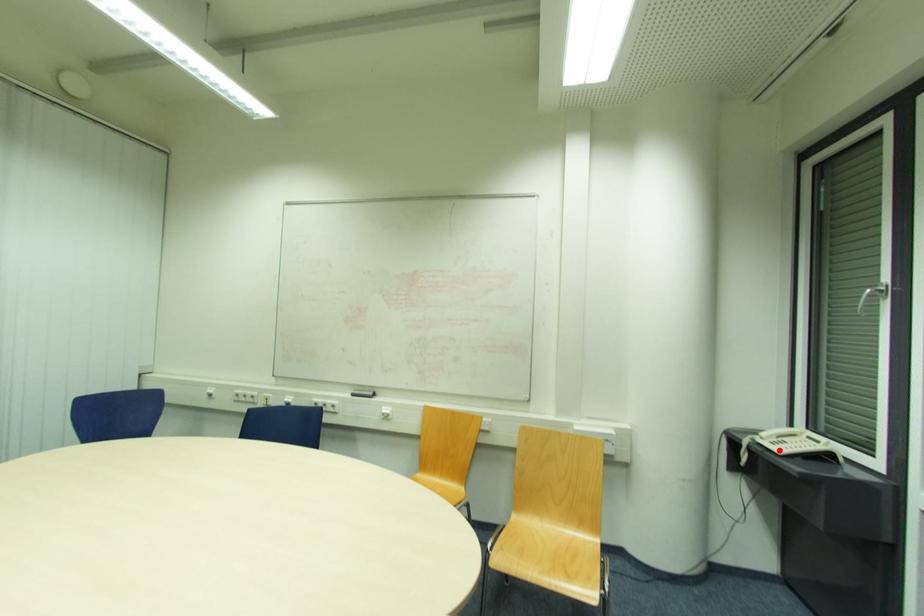
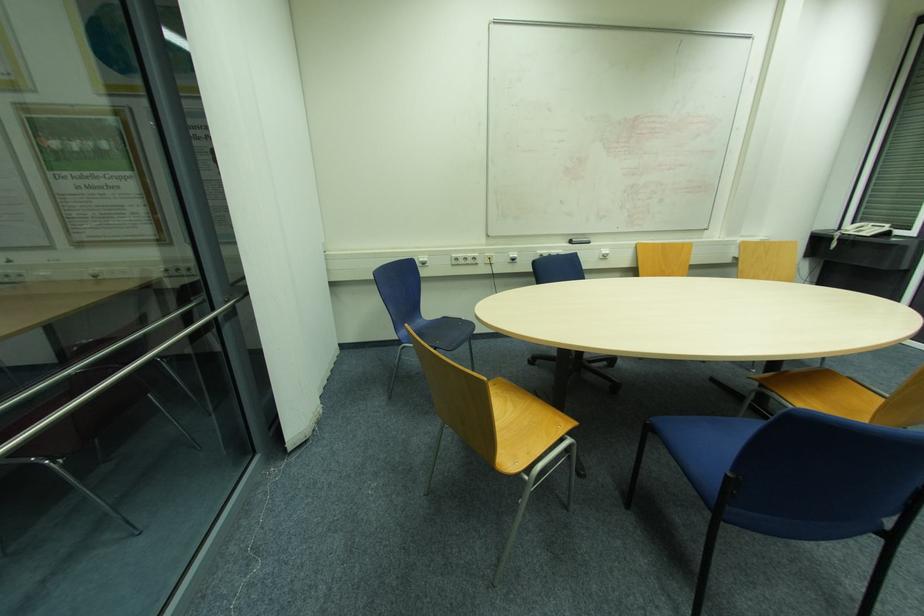
Question: I am providing you with two images of the same scene from different viewpoints. Image1 has a red point marked. In image2, the corresponding 3D location appears at what relative position? Reply with the corresponding letter.

Choices:
 (A) Closer
 (B) Farther

Answer: (B)